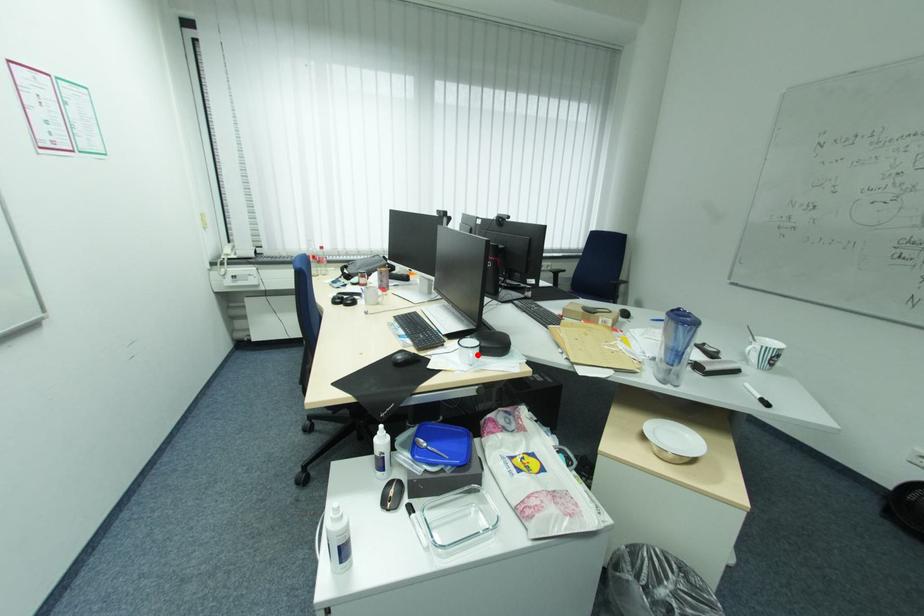
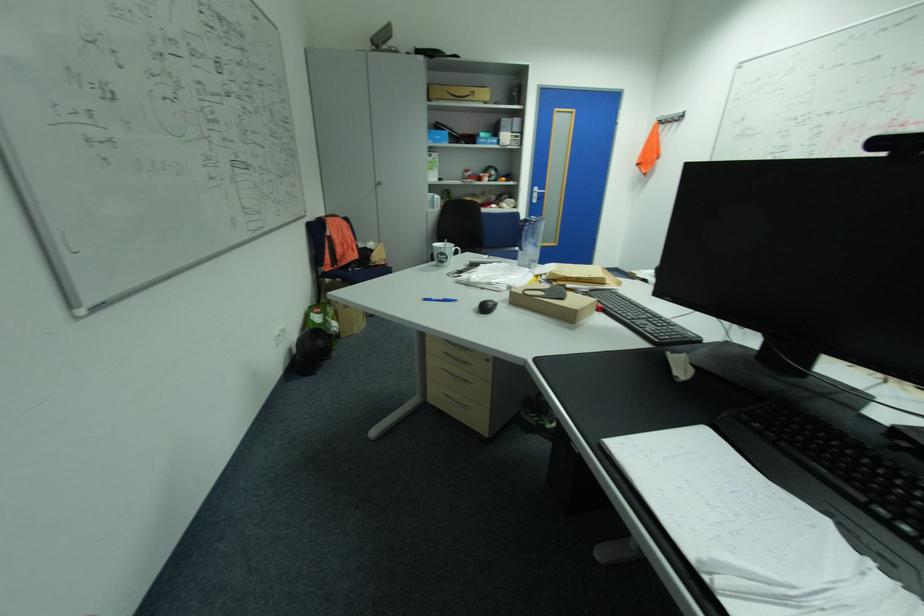
Question: I am providing you with two images of the same scene from different viewpoints. A red point is marked on the first image. Can you still see the location of the red point in image 2?

Choices:
 (A) Yes
 (B) No

Answer: (B)